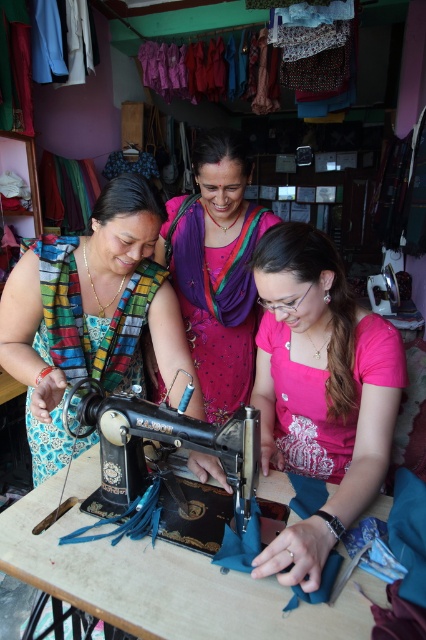
Question: Is wooden table at center closer to camera compared to black metal sewing machine at center?

Choices:
 (A) no
 (B) yes

Answer: (B)

Question: Which object is closer to the camera taking this photo?

Choices:
 (A) black metal sewing machine at center
 (B) pink satin saree at center
 (C) pink satin shirt at center

Answer: (C)

Question: Which object is positioned farthest from the pink satin shirt at center?

Choices:
 (A) black metal sewing machine at center
 (B) pink satin saree at center

Answer: (B)

Question: Is multicolored fabric at center smaller than pink satin saree at center?

Choices:
 (A) yes
 (B) no

Answer: (B)

Question: Among these objects, which one is nearest to the camera?

Choices:
 (A) pink satin saree at center
 (B) black metal sewing machine at center
 (C) wooden table at center
 (D) pink satin shirt at center

Answer: (C)

Question: Is pink satin saree at center below black metal sewing machine at center?

Choices:
 (A) no
 (B) yes

Answer: (A)